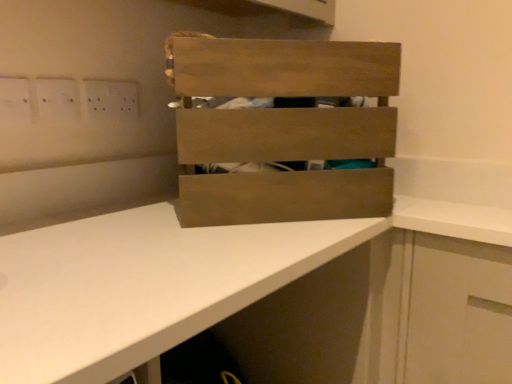
Question: Is white plastic electric outlet at upper left not within wooden crate at center?

Choices:
 (A) yes
 (B) no

Answer: (A)

Question: Does white plastic electric outlet at upper left appear on the left side of wooden crate at center?

Choices:
 (A) no
 (B) yes

Answer: (B)

Question: Can you confirm if white plastic electric outlet at upper left is wider than wooden crate at center?

Choices:
 (A) yes
 (B) no

Answer: (B)

Question: Is white plastic electric outlet at upper left shorter than wooden crate at center?

Choices:
 (A) no
 (B) yes

Answer: (B)

Question: Is white plastic electric outlet at upper left touching wooden crate at center?

Choices:
 (A) no
 (B) yes

Answer: (A)

Question: Is white plastic electric outlet at upper left closer to the viewer compared to wooden crate at center?

Choices:
 (A) no
 (B) yes

Answer: (A)

Question: Does wooden crate at center turn towards white plastic electric outlet at upper left?

Choices:
 (A) yes
 (B) no

Answer: (B)

Question: Is wooden crate at center in front of white plastic electric outlet at upper left?

Choices:
 (A) no
 (B) yes

Answer: (B)

Question: Can you confirm if wooden crate at center is bigger than white plastic electric outlet at upper left?

Choices:
 (A) no
 (B) yes

Answer: (B)

Question: Is wooden crate at center turned away from white plastic electric outlet at upper left?

Choices:
 (A) yes
 (B) no

Answer: (B)

Question: Does wooden crate at center appear on the left side of white plastic electric outlet at upper left?

Choices:
 (A) yes
 (B) no

Answer: (B)

Question: Is wooden crate at center surrounding white plastic electric outlet at upper left?

Choices:
 (A) no
 (B) yes

Answer: (A)

Question: Is white plastic electric outlet at upper left touching white matte countertop at center?

Choices:
 (A) no
 (B) yes

Answer: (A)